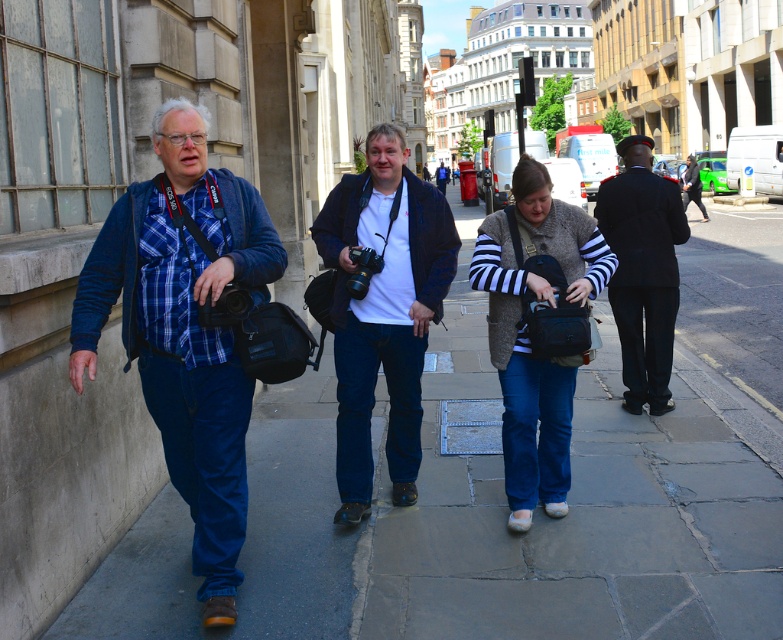
Can you confirm if striped sweater at center is thinner than black plastic camera at center?

No, striped sweater at center is not thinner than black plastic camera at center.

Can you confirm if striped sweater at center is smaller than black plastic camera at center?

Actually, striped sweater at center might be larger than black plastic camera at center.

Is point (531, 237) closer to camera compared to point (381, 262)?

Yes, point (531, 237) is closer to viewer.

Locate an element on the screen. Image resolution: width=783 pixels, height=640 pixels. striped sweater at center is located at coordinates (527, 332).

Is point (742, 352) farther from camera compared to point (222, 316)?

That is True.

Is paved stone sidewalk at left below black plastic camera at left?

No.

Locate an element on the screen. The image size is (783, 640). paved stone sidewalk at left is located at coordinates (507, 509).

Which is behind, point (493, 508) or point (377, 257)?

The point (493, 508) is more distant.

The width and height of the screenshot is (783, 640). I want to click on paved stone sidewalk at left, so click(x=507, y=509).